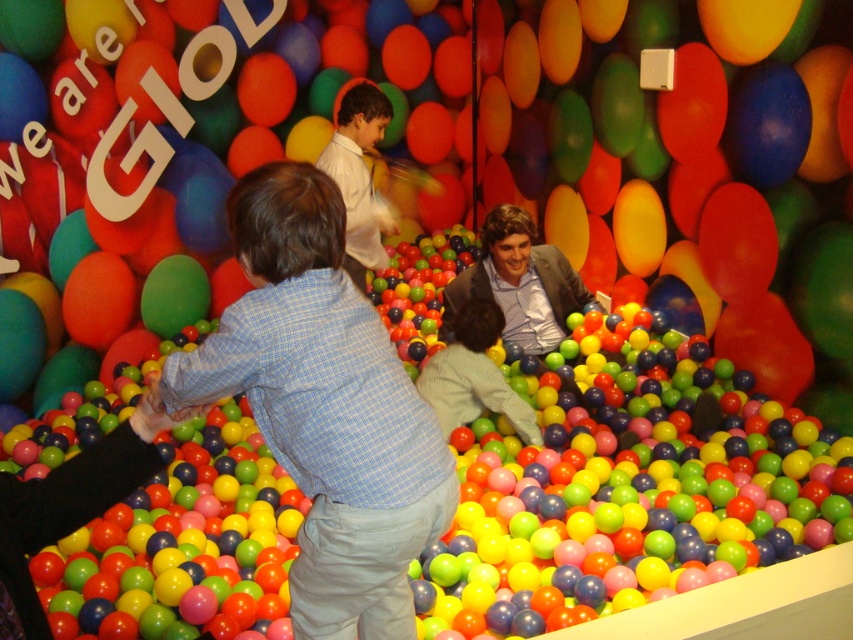
You are a photographer standing at the edge of the ball pit. You want to take a photo that includes both the light green fabric shirt at center and the white glossy shirt at center. The camera you are using has a maximum focus range of 36 inches. Can you capture both subjects in focus without moving your position?

The distance between the light green fabric shirt at center and the white glossy shirt at center is 37.31 inches, which exceeds the camera maximum focus range of 36 inches. Therefore, you cannot capture both subjects in focus without moving your position.

You are a photographer trying to capture a photo of both the blue checkered shirt at center and the light green fabric shirt at center. Since you want to include both in the frame, which one should you focus on first to ensure the other is also in the shot?

The blue checkered shirt at center is below the light green fabric shirt at center, so you should focus on the light green fabric shirt at center first to ensure the blue checkered shirt at center is also in the shot.